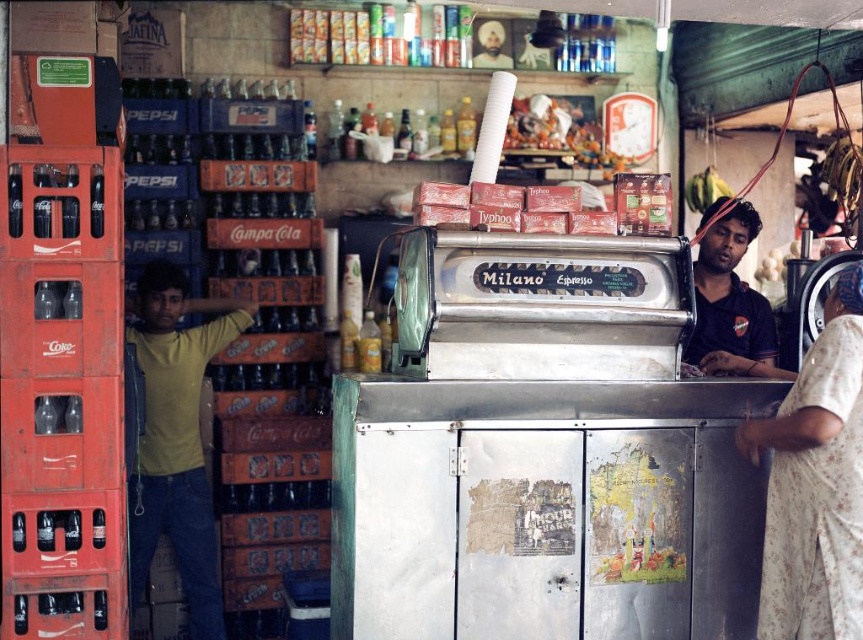
Question: Which of these objects is positioned farthest from the yellow t-shirt at left?

Choices:
 (A) dark blue shirt at right
 (B) floral fabric dress at right

Answer: (B)

Question: Is yellow t-shirt at left bigger than dark blue shirt at right?

Choices:
 (A) no
 (B) yes

Answer: (B)

Question: Which point is farther to the camera?

Choices:
 (A) (156, 353)
 (B) (778, 460)
 (C) (759, 308)

Answer: (A)

Question: Which point is farther to the camera?

Choices:
 (A) yellow t-shirt at left
 (B) floral fabric dress at right
 (C) dark blue shirt at right

Answer: (A)

Question: Is floral fabric dress at right further to the viewer compared to dark blue shirt at right?

Choices:
 (A) yes
 (B) no

Answer: (B)

Question: Is yellow t-shirt at left bigger than dark blue shirt at right?

Choices:
 (A) yes
 (B) no

Answer: (A)